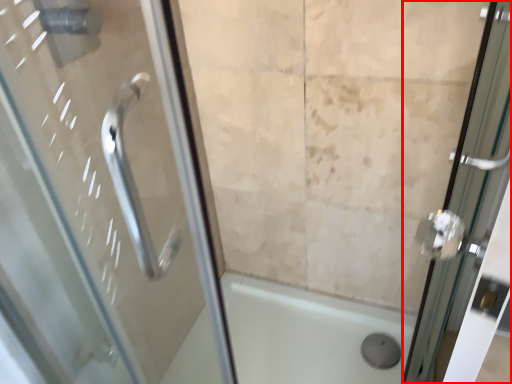
Question: From the image's perspective, what is the correct spatial positioning of door (annotated by the red box) in reference to bath?

Choices:
 (A) above
 (B) below

Answer: (A)